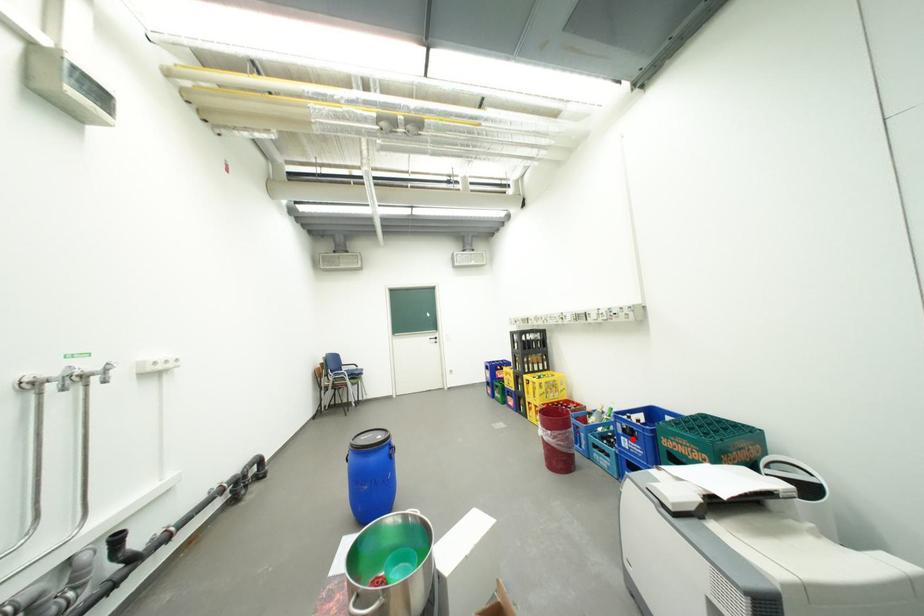
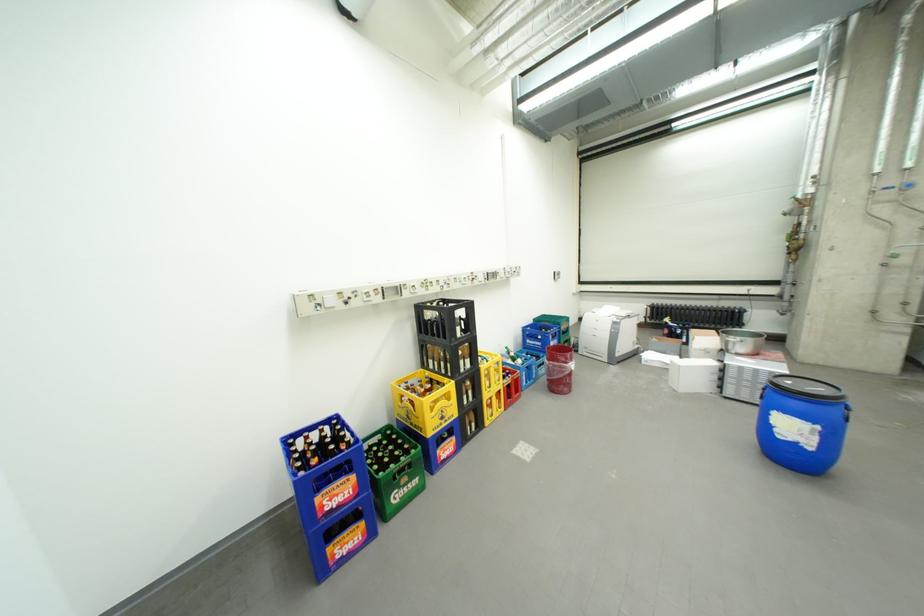
Question: A red point is marked in image1. In image2, is the corresponding 3D point closer to the camera or farther? Reply with the corresponding letter.

Choices:
 (A) The corresponding 3D point is closer.
 (B) The corresponding 3D point is farther.

Answer: (B)